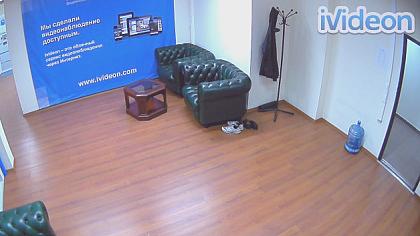
Locate an element on the screen. This screenshot has height=236, width=420. door is located at coordinates (405, 150).